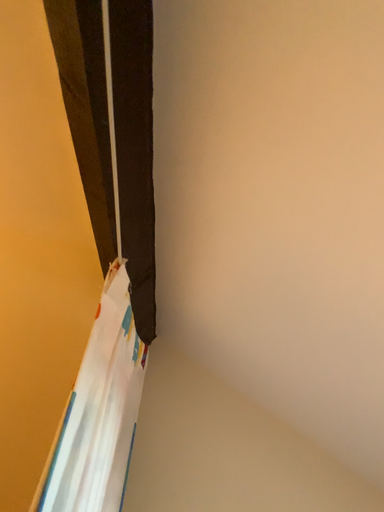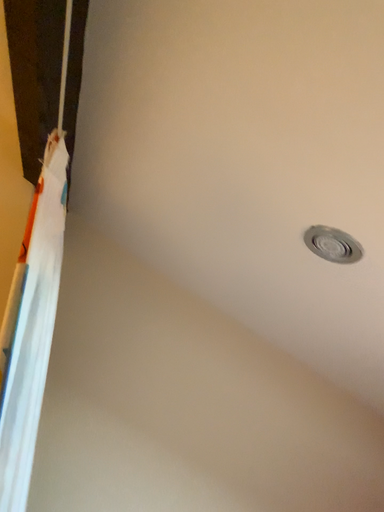
Question: Which way did the camera rotate in the video?

Choices:
 (A) rotated upward
 (B) rotated downward

Answer: (B)